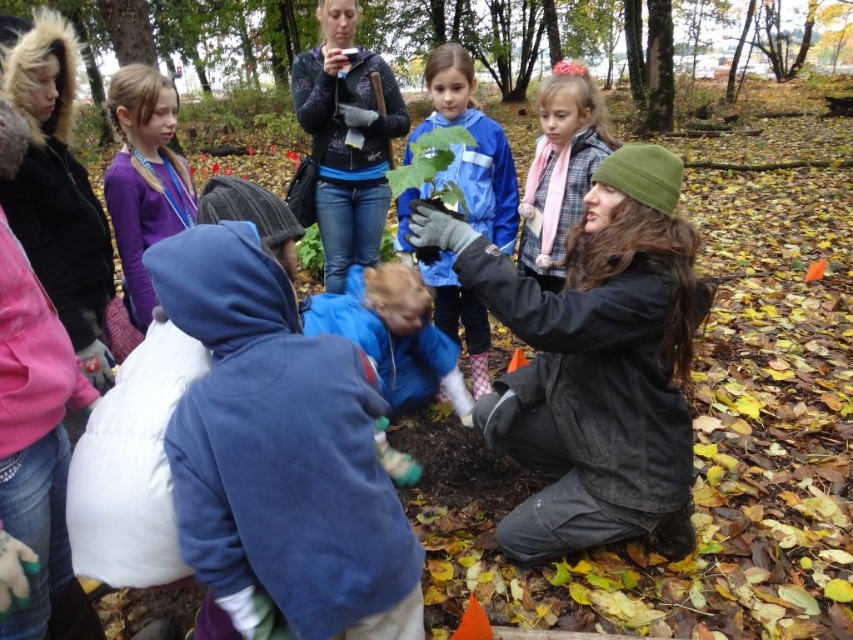
You are standing at point (503,36) and want to walk towards the tree planting area. Is the point (576,474) in your path?

Yes, the point (576,474) is in front of point (503,36), so it is in your path towards the tree planting area.

You are a drone operator who needs to capture a photo of the green leafy plant at upper center and the purple fleece jacket at upper left in the same frame. Given that your drone camera has a maximum zoom range of 15 meters, can you ensure both objects are in the same frame without moving the drone?

The distance between the green leafy plant at upper center and the purple fleece jacket at upper left is 18.66 meters. Since the camera can only zoom up to 15 meters, the drone cannot capture both objects in the same frame without moving closer or adjusting the position.

Consider the image. You are a photographer trying to capture a clear shot of the green leafy plant at upper center. However, the matte black jacket at center is blocking your view. Can you move around to the left side to get a better angle? Explain why or why not based on their positions.

The matte black jacket at center is in front of the green leafy plant at upper center, so moving to the left side might not help because the jacket is already blocking the plant. You might need to move to the right or behind the jacket to get an unobstructed view.